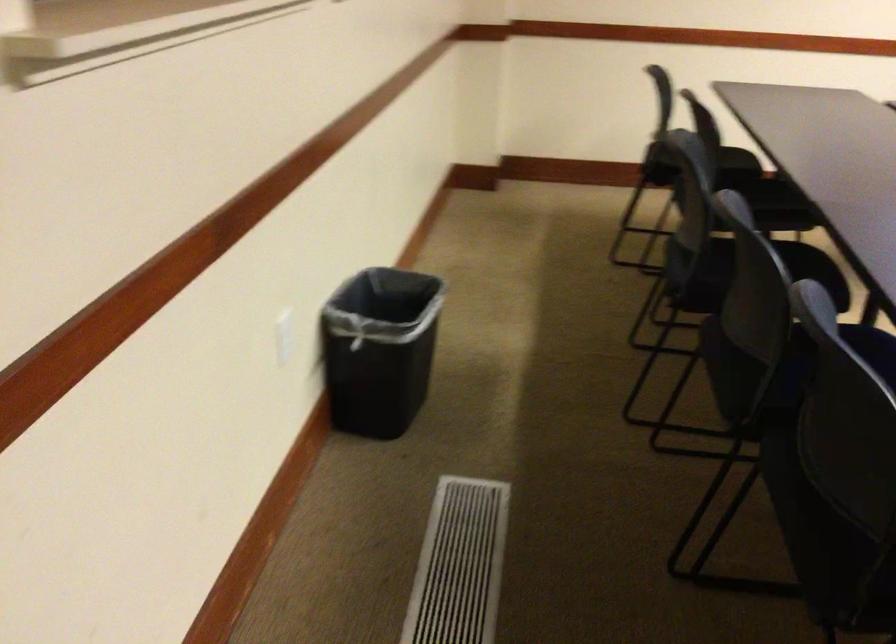
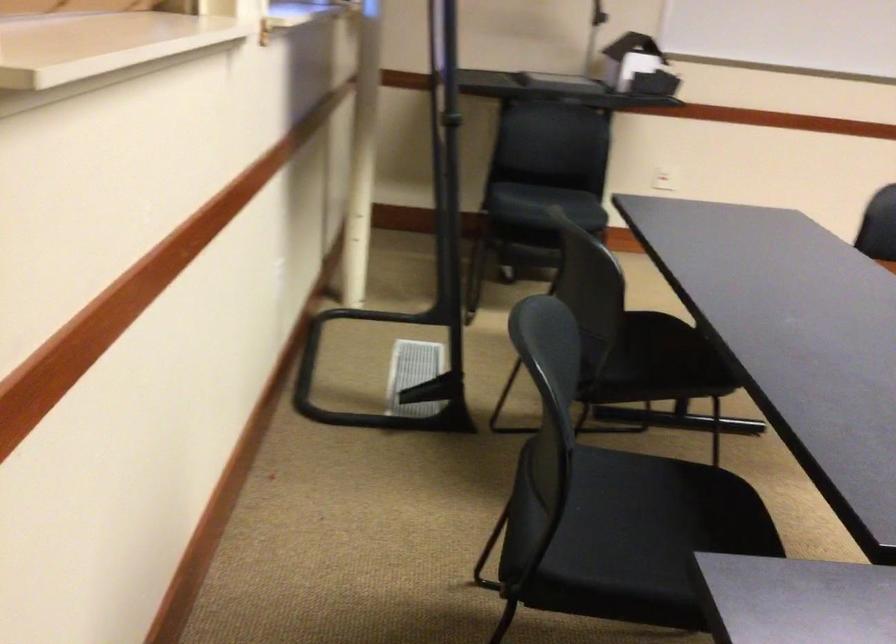
Question: The images are taken continuously from a first-person perspective. In which direction are you moving?

Choices:
 (A) Left
 (B) Right
 (C) Forward
 (D) Backward

Answer: (D)